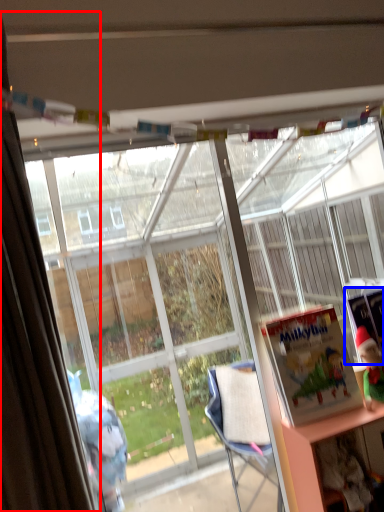
Question: Which object appears closest to the camera in this image, curtain (highlighted by a red box) or book (highlighted by a blue box)?

Choices:
 (A) curtain
 (B) book

Answer: (A)